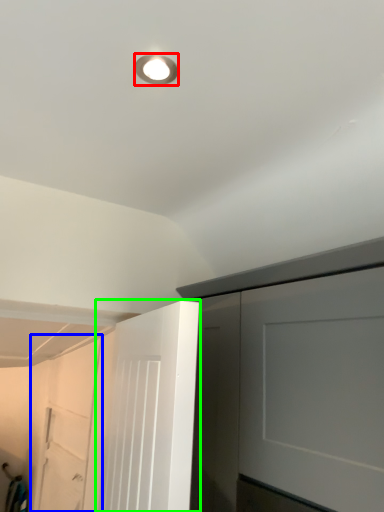
Question: Considering the real-world distances, which object is closest to droplight (highlighted by a red box)? garage door (highlighted by a blue box) or door (highlighted by a green box).

Choices:
 (A) garage door
 (B) door

Answer: (B)